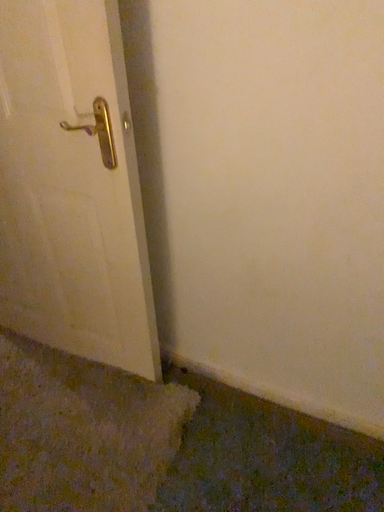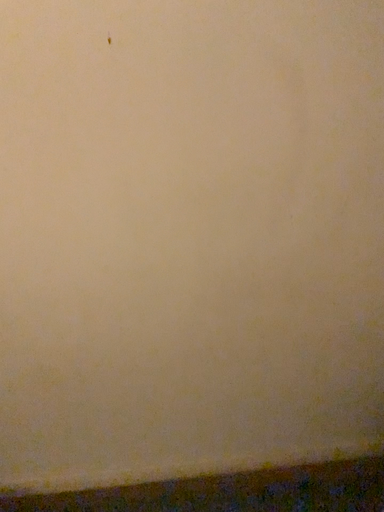
Question: How did the camera likely rotate when shooting the video?

Choices:
 (A) rotated right
 (B) rotated left

Answer: (A)